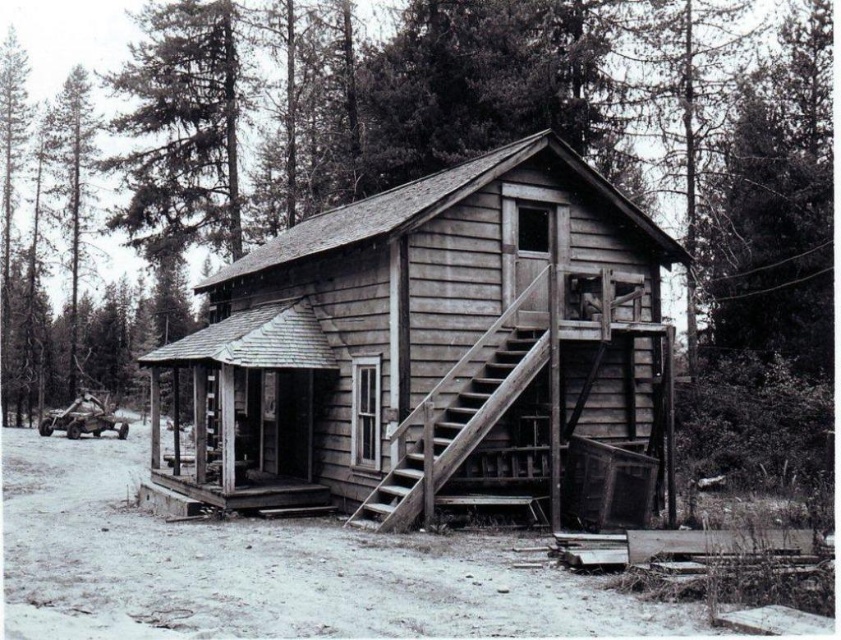
Is the position of weathered wood cabin at center less distant than that of weathered wood stairs at center?

No.

Who is more forward, (517, 474) or (398, 477)?

Point (398, 477) is in front.

This screenshot has height=640, width=841. Identify the location of weathered wood cabin at center. (438, 349).